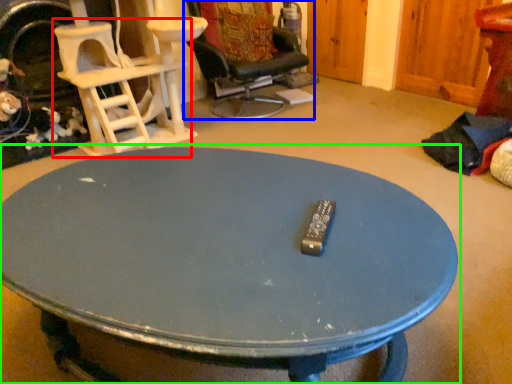
Question: Estimate the real-world distances between objects in this image. Which object is farther from chair (highlighted by a red box), chair (highlighted by a blue box) or coffee table (highlighted by a green box)?

Choices:
 (A) chair
 (B) coffee table

Answer: (B)